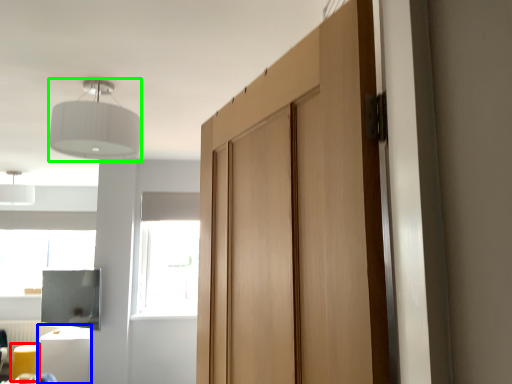
Question: Which is farther away from furniture (highlighted by a red box)? furniture (highlighted by a blue box) or light fixture (highlighted by a green box)?

Choices:
 (A) furniture
 (B) light fixture

Answer: (B)